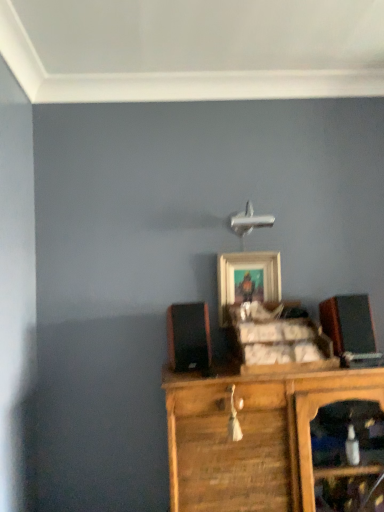
Question: Is black matte speaker at right, which is counted as the second speaker, starting from the left, to the right of wooden framed picture at center from the viewer's perspective?

Choices:
 (A) yes
 (B) no

Answer: (A)

Question: Considering the relative sizes of black matte speaker at right, which is counted as the 1th speaker, starting from the right, and wooden framed picture at center in the image provided, is black matte speaker at right, which is counted as the 1th speaker, starting from the right, shorter than wooden framed picture at center?

Choices:
 (A) yes
 (B) no

Answer: (A)

Question: Is black matte speaker at right, which is counted as the 1th speaker, starting from the right, beside wooden framed picture at center?

Choices:
 (A) yes
 (B) no

Answer: (B)

Question: From the image's perspective, is black matte speaker at right, which is counted as the second speaker, starting from the left, over wooden framed picture at center?

Choices:
 (A) yes
 (B) no

Answer: (B)

Question: Is black matte speaker at right, which is counted as the second speaker, starting from the left, to the left of wooden framed picture at center from the viewer's perspective?

Choices:
 (A) yes
 (B) no

Answer: (B)

Question: Could you tell me if black matte speaker at right, which is counted as the 1th speaker, starting from the right, is turned towards wooden framed picture at center?

Choices:
 (A) yes
 (B) no

Answer: (B)

Question: Is wooden framed picture at center smaller than black matte speaker at left, acting as the second speaker starting from the right?

Choices:
 (A) yes
 (B) no

Answer: (A)

Question: Is the depth of wooden framed picture at center less than that of black matte speaker at left, acting as the second speaker starting from the right?

Choices:
 (A) no
 (B) yes

Answer: (A)

Question: Is wooden framed picture at center looking in the opposite direction of black matte speaker at left, the first speaker in the left-to-right sequence?

Choices:
 (A) yes
 (B) no

Answer: (B)

Question: From the image's perspective, would you say wooden framed picture at center is positioned over black matte speaker at left, the first speaker in the left-to-right sequence?

Choices:
 (A) yes
 (B) no

Answer: (A)

Question: Can you confirm if wooden framed picture at center is taller than black matte speaker at left, acting as the second speaker starting from the right?

Choices:
 (A) no
 (B) yes

Answer: (B)

Question: Can you confirm if wooden framed picture at center is wider than black matte speaker at left, the first speaker in the left-to-right sequence?

Choices:
 (A) yes
 (B) no

Answer: (B)

Question: Can you confirm if wooden cabinet at center is smaller than black matte speaker at left, the first speaker in the left-to-right sequence?

Choices:
 (A) no
 (B) yes

Answer: (A)